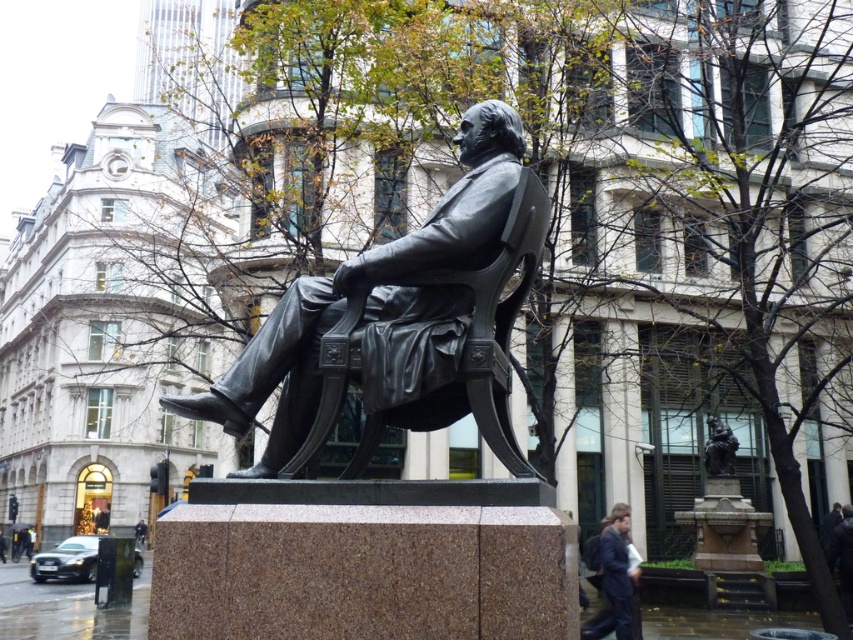
You are standing in front of the bronze statue of a seated man. You notice two points marked on the statue. One is at coordinate point (630,628) and the other at point (717,454). Which of these two points is closer to your current position?

Point (630,628) is closer to the camera than point (717,454).